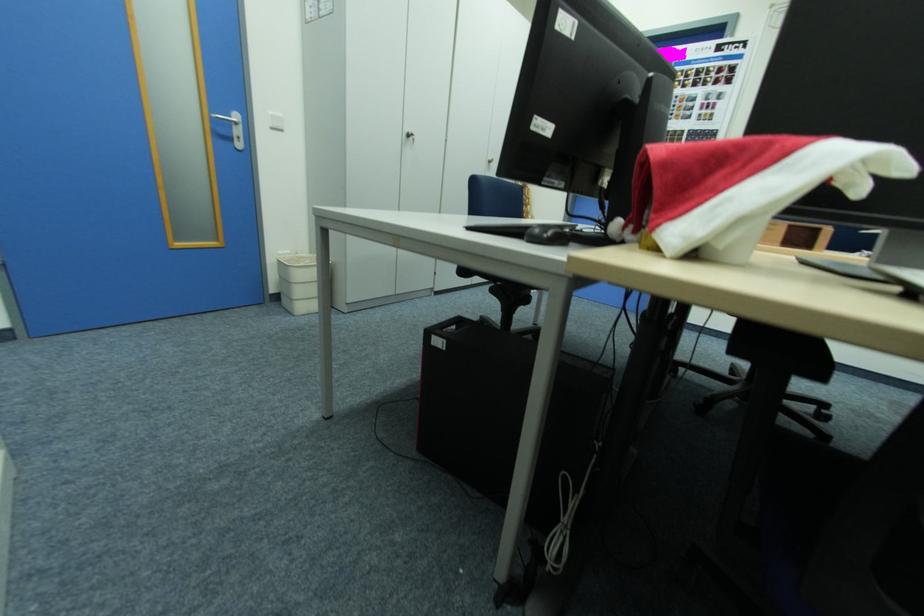
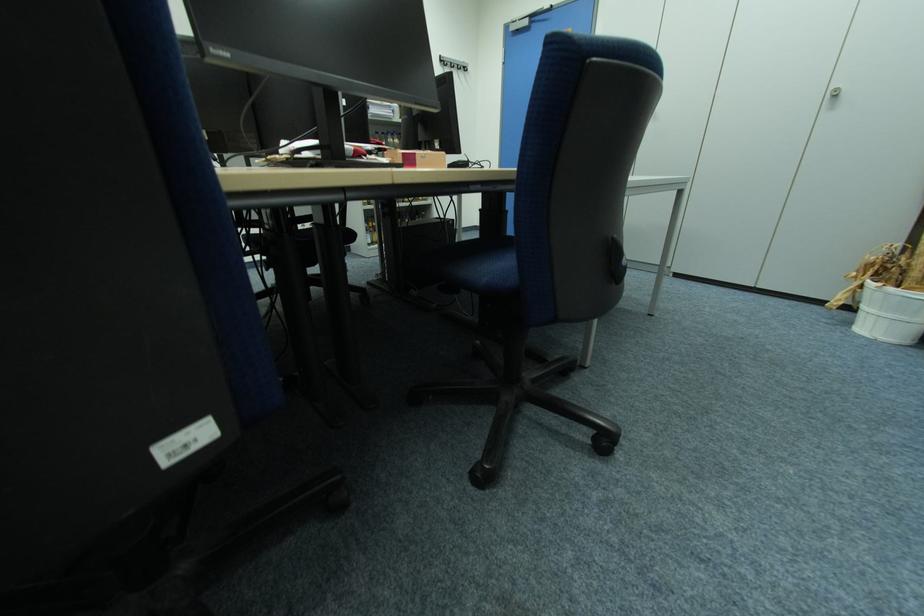
Question: I am providing you with two images of the same scene from different viewpoints. Please identify which objects are invisible in image2.

Choices:
 (A) white cabinet handle
 (B) stuffed penguin toy
 (C) white light switch
 (D) white bucket

Answer: (C)